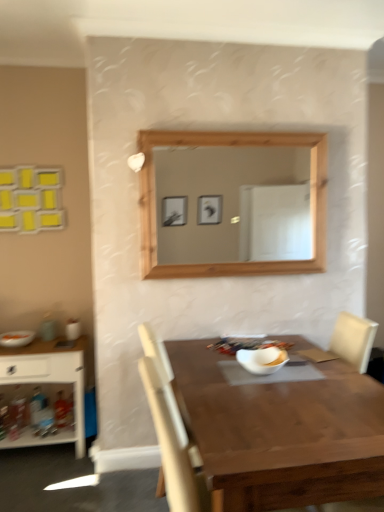
Question: Does matte orange bowl at left, which appears as the first food when viewed from the left, appear on the right side of wooden table at center?

Choices:
 (A) no
 (B) yes

Answer: (A)

Question: From the image's perspective, does matte orange bowl at left, which is counted as the first food, starting from the back, appear lower than wooden table at center?

Choices:
 (A) no
 (B) yes

Answer: (A)

Question: Would you say wooden table at center is part of matte orange bowl at left, which appears as the first food when viewed from the left,'s contents?

Choices:
 (A) no
 (B) yes

Answer: (A)

Question: From a real-world perspective, is matte orange bowl at left, the 2th food in the front-to-back sequence, on wooden table at center?

Choices:
 (A) no
 (B) yes

Answer: (B)

Question: Is matte orange bowl at left, which appears as the first food when viewed from the left, behind wooden table at center?

Choices:
 (A) yes
 (B) no

Answer: (A)

Question: Is matte orange bowl at left, which is counted as the first food, starting from the back, at the left side of wooden table at center?

Choices:
 (A) yes
 (B) no

Answer: (A)

Question: Is wooden table at center oriented away from matte orange bowl at left, which is counted as the first food, starting from the back?

Choices:
 (A) no
 (B) yes

Answer: (A)

Question: Does wooden table at center have a greater width compared to matte orange bowl at left, which is counted as the first food, starting from the back?

Choices:
 (A) yes
 (B) no

Answer: (A)

Question: Is wooden table at center thinner than matte orange bowl at left, the 2th food in the front-to-back sequence?

Choices:
 (A) no
 (B) yes

Answer: (A)

Question: From a real-world perspective, does wooden table at center sit lower than matte orange bowl at left, arranged as the second food when viewed from the right?

Choices:
 (A) no
 (B) yes

Answer: (B)

Question: Is wooden table at center to the right of matte orange bowl at left, arranged as the second food when viewed from the right, from the viewer's perspective?

Choices:
 (A) no
 (B) yes

Answer: (B)

Question: Does wooden table at center turn towards matte orange bowl at left, which appears as the first food when viewed from the left?

Choices:
 (A) no
 (B) yes

Answer: (A)

Question: Could you tell me if white wood shelf at left is turned towards matte orange bowl at left, which appears as the first food when viewed from the left?

Choices:
 (A) no
 (B) yes

Answer: (A)